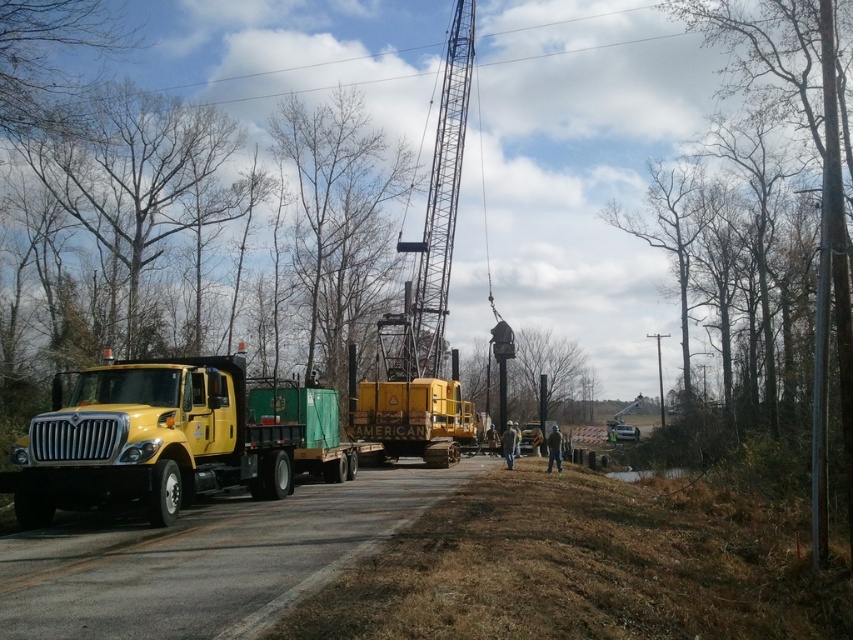
Does yellow matte truck at left have a lesser width compared to metallic gray crane at upper center?

No.

Consider the image. Can you confirm if yellow matte truck at left is positioned to the right of metallic gray crane at upper center?

No, yellow matte truck at left is not to the right of metallic gray crane at upper center.

Is point (178, 400) farther from viewer compared to point (450, 70)?

No.

Where is `yellow matte truck at left`? yellow matte truck at left is located at coordinates (172, 438).